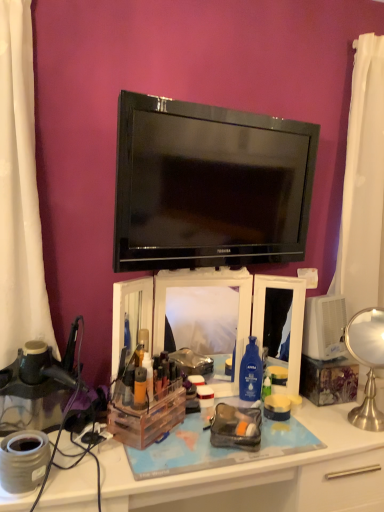
This screenshot has height=512, width=384. Find the location of `clear plastic makeup organizer at center`. clear plastic makeup organizer at center is located at coordinates (165, 309).

Describe the element at coordinates (165, 309) in the screenshot. I see `clear plastic makeup organizer at center` at that location.

In the scene shown: What is the approximate width of matte orange bottle at center, marked as the 2th toiletry in a back-to-front arrangement?

matte orange bottle at center, marked as the 2th toiletry in a back-to-front arrangement, is 1.46 inches wide.

Identify the location of clear plastic organizer at center. This screenshot has width=384, height=512. (262, 474).

Which object is further away from the camera, black glossy tv at center or clear plastic organizer at center?

black glossy tv at center is behind.

Which of these two, black glossy tv at center or clear plastic organizer at center, stands shorter?

black glossy tv at center is shorter.

Can you confirm if black glossy tv at center is bigger than clear plastic organizer at center?

Incorrect, black glossy tv at center is not larger than clear plastic organizer at center.

Which is less distant, [296,254] or [344,423]?

The point [344,423] is in front.

Is clear plastic makeup organizer at center completely or partially outside of black glossy tv at center?

Yes, clear plastic makeup organizer at center is not within black glossy tv at center.

Considering the sizes of clear plastic makeup organizer at center and black glossy tv at center in the image, is clear plastic makeup organizer at center bigger or smaller than black glossy tv at center?

In the image, clear plastic makeup organizer at center appears to be larger than black glossy tv at center.

Is clear plastic makeup organizer at center directly adjacent to black glossy tv at center?

clear plastic makeup organizer at center and black glossy tv at center are clearly separated.

Between clear plastic makeup organizer at center and black glossy tv at center, which one has smaller width?

black glossy tv at center.

From the image's perspective, is translucent plastic container at center, placed as the 1th toiletry when sorted from back to front, on clear plastic makeup organizer at center?

No, from the image's perspective, translucent plastic container at center, placed as the 1th toiletry when sorted from back to front, is not on top of clear plastic makeup organizer at center.

How far apart are translucent plastic container at center, placed as the 1th toiletry when sorted from back to front, and clear plastic makeup organizer at center?

The distance of translucent plastic container at center, placed as the 1th toiletry when sorted from back to front, from clear plastic makeup organizer at center is 14.57 inches.

From a real-world perspective, is translucent plastic container at center, the second toiletry viewed from the front, physically above clear plastic makeup organizer at center?

No.

Between translucent plastic container at center, the second toiletry viewed from the front, and clear plastic makeup organizer at center, which one has less height?

With less height is translucent plastic container at center, the second toiletry viewed from the front.

In the image, is black glossy tv at center on the left side or the right side of clear plastic makeup organizer at center?

In the image, black glossy tv at center appears on the right side of clear plastic makeup organizer at center.

Considering the sizes of objects black glossy tv at center and clear plastic makeup organizer at center in the image provided, who is bigger, black glossy tv at center or clear plastic makeup organizer at center?

clear plastic makeup organizer at center is bigger.

You are a GUI agent. You are given a task and a screenshot of the screen. Output one action in this format:
    pyautogui.click(x=<x>, y=<y>)
    Task: Click on the cabinet on the left of black glossy tv at center
    The width and height of the screenshot is (384, 512).
    Given the screenshot: What is the action you would take?
    pyautogui.click(x=165, y=309)

Is black glossy tv at center aimed at clear plastic makeup organizer at center?

No, black glossy tv at center does not turn towards clear plastic makeup organizer at center.

Between matte orange bottle at center, which is the first toiletry in front-to-back order, and clear plastic makeup organizer at center, which one appears on the right side from the viewer's perspective?

clear plastic makeup organizer at center is more to the right.

Would you say clear plastic makeup organizer at center is part of matte orange bottle at center, which is the first toiletry in front-to-back order,'s contents?

No, clear plastic makeup organizer at center is located outside of matte orange bottle at center, which is the first toiletry in front-to-back order.

Considering the relative sizes of matte orange bottle at center, which is the first toiletry in front-to-back order, and clear plastic makeup organizer at center in the image provided, is matte orange bottle at center, which is the first toiletry in front-to-back order, bigger than clear plastic makeup organizer at center?

Incorrect, matte orange bottle at center, which is the first toiletry in front-to-back order, is not larger than clear plastic makeup organizer at center.

Considering the relative sizes of matte orange bottle at center, marked as the 2th toiletry in a back-to-front arrangement, and clear plastic makeup organizer at center in the image provided, is matte orange bottle at center, marked as the 2th toiletry in a back-to-front arrangement, shorter than clear plastic makeup organizer at center?

Indeed, matte orange bottle at center, marked as the 2th toiletry in a back-to-front arrangement, has a lesser height compared to clear plastic makeup organizer at center.

Would you say translucent plastic container at center, placed as the 1th toiletry when sorted from back to front, contains polished silver table lamp at right?

That's incorrect, polished silver table lamp at right is not inside translucent plastic container at center, placed as the 1th toiletry when sorted from back to front.

Which is more to the right, translucent plastic container at center, placed as the 1th toiletry when sorted from back to front, or polished silver table lamp at right?

polished silver table lamp at right is more to the right.

Is translucent plastic container at center, placed as the 1th toiletry when sorted from back to front, thinner than polished silver table lamp at right?

Yes.

In terms of height, does matte orange bottle at center, marked as the 2th toiletry in a back-to-front arrangement, look taller or shorter compared to clear plastic organizer at center?

matte orange bottle at center, marked as the 2th toiletry in a back-to-front arrangement, is shorter than clear plastic organizer at center.

How many degrees apart are the facing directions of matte orange bottle at center, marked as the 2th toiletry in a back-to-front arrangement, and clear plastic organizer at center?

The facing directions of matte orange bottle at center, marked as the 2th toiletry in a back-to-front arrangement, and clear plastic organizer at center are 38 degrees apart.

From the image's perspective, is matte orange bottle at center, marked as the 2th toiletry in a back-to-front arrangement, located above or below clear plastic organizer at center?

From the image's perspective, matte orange bottle at center, marked as the 2th toiletry in a back-to-front arrangement, appears above clear plastic organizer at center.

Where is `television that is above the clear plastic organizer at center (from a real-world perspective)`? The height and width of the screenshot is (512, 384). television that is above the clear plastic organizer at center (from a real-world perspective) is located at coordinates click(x=209, y=185).

At what (x,y) coordinates should I click in order to perform the action: click on cabinet on the left of black glossy tv at center. Please return your answer as a coordinate pair (x, y). This screenshot has height=512, width=384. Looking at the image, I should click on coord(165,309).

Which object lies further to the anchor point polished silver table lamp at right, translucent plastic container at center, the second toiletry viewed from the front, or clear plastic organizer at center?

translucent plastic container at center, the second toiletry viewed from the front, is positioned further to the anchor polished silver table lamp at right.

Considering their positions, is clear plastic makeup organizer at center positioned closer to black glossy tv at center than translucent plastic container at center, the second toiletry viewed from the front?

clear plastic makeup organizer at center lies closer to black glossy tv at center than the other object.

Estimate the real-world distances between objects in this image. Which object is further from clear plastic organizer at center, black glossy tv at center or translucent plastic container at center, placed as the 1th toiletry when sorted from back to front?

Among the two, black glossy tv at center is located further to clear plastic organizer at center.

Based on their spatial positions, is matte orange bottle at center, marked as the 2th toiletry in a back-to-front arrangement, or clear plastic organizer at center closer to translucent plastic container at center, the second toiletry viewed from the front?

The object closer to translucent plastic container at center, the second toiletry viewed from the front, is matte orange bottle at center, marked as the 2th toiletry in a back-to-front arrangement.

Looking at the image, which one is located further to black glossy tv at center, matte orange bottle at center, which is the first toiletry in front-to-back order, or translucent plastic container at center, placed as the 1th toiletry when sorted from back to front?

Among the two, matte orange bottle at center, which is the first toiletry in front-to-back order, is located further to black glossy tv at center.

Based on their spatial positions, is matte orange bottle at center, marked as the 2th toiletry in a back-to-front arrangement, or polished silver table lamp at right closer to translucent plastic container at center, placed as the 1th toiletry when sorted from back to front?

matte orange bottle at center, marked as the 2th toiletry in a back-to-front arrangement, is closer to translucent plastic container at center, placed as the 1th toiletry when sorted from back to front.

Based on their spatial positions, is clear plastic organizer at center or translucent plastic container at center, placed as the 1th toiletry when sorted from back to front, closer to black glossy tv at center?

Based on the image, translucent plastic container at center, placed as the 1th toiletry when sorted from back to front, appears to be nearer to black glossy tv at center.

From the image, which object appears to be farther from black glossy tv at center, clear plastic makeup organizer at center or polished silver table lamp at right?

polished silver table lamp at right is positioned further to the anchor black glossy tv at center.

I want to click on cabinet located between translucent plastic container at center, the second toiletry viewed from the front, and polished silver table lamp at right in the left-right direction, so click(x=165, y=309).

The image size is (384, 512). Find the location of `table lamp between black glossy tv at center and clear plastic organizer at center vertically`. table lamp between black glossy tv at center and clear plastic organizer at center vertically is located at coordinates (367, 362).

Image resolution: width=384 pixels, height=512 pixels. I want to click on toiletry situated between matte orange bottle at center, marked as the 2th toiletry in a back-to-front arrangement, and polished silver table lamp at right from left to right, so click(148, 374).

Where is `desk between translucent plastic container at center, placed as the 1th toiletry when sorted from back to front, and polished silver table lamp at right`? This screenshot has height=512, width=384. desk between translucent plastic container at center, placed as the 1th toiletry when sorted from back to front, and polished silver table lamp at right is located at coordinates (262, 474).